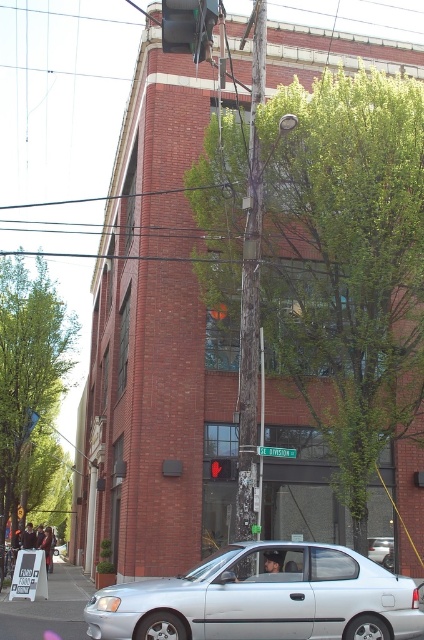
Question: Which of the following is the farthest from the observer?

Choices:
 (A) silver metallic car at center
 (B) silver metallic car at lower center
 (C) red glass traffic light at center
 (D) metallic red traffic light at upper center

Answer: (A)

Question: Which is nearer to the red glass traffic light at center?

Choices:
 (A) silver metallic car at lower center
 (B) metallic red traffic light at upper center

Answer: (A)

Question: Among these objects, which one is nearest to the camera?

Choices:
 (A) silver metallic car at center
 (B) metallic red traffic light at upper center
 (C) red glass traffic light at center

Answer: (B)

Question: Does silver metallic car at lower center appear on the right side of red glass traffic light at center?

Choices:
 (A) yes
 (B) no

Answer: (A)

Question: Is metallic red traffic light at upper center wider than red glass traffic light at center?

Choices:
 (A) yes
 (B) no

Answer: (A)

Question: Does silver metallic car at lower center have a lesser width compared to metallic red traffic light at upper center?

Choices:
 (A) no
 (B) yes

Answer: (A)